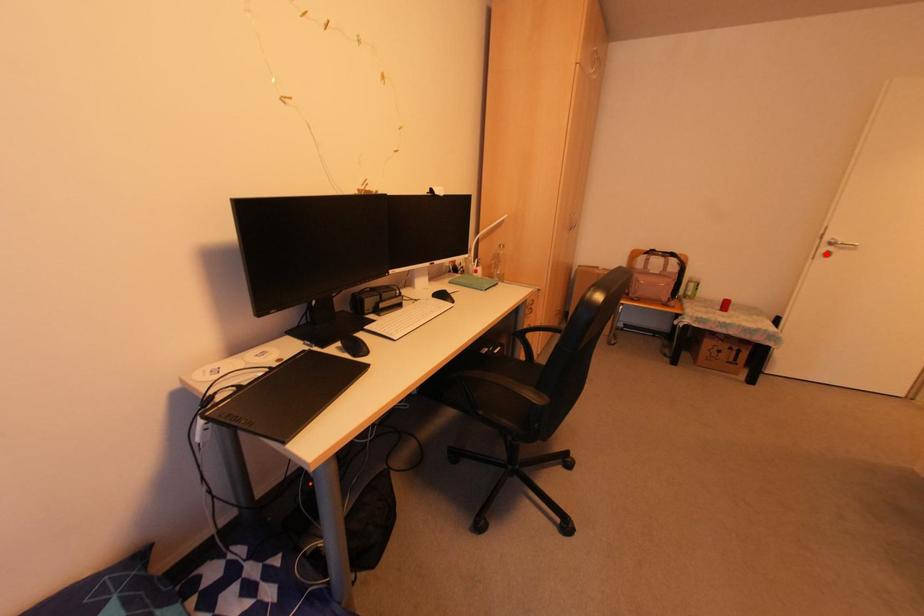
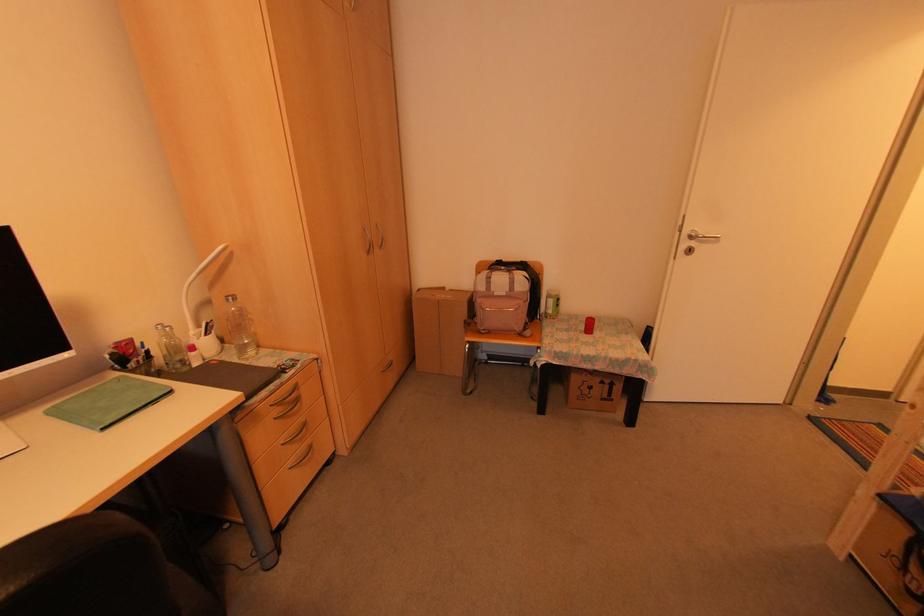
Question: A red point is marked in image1. In image2, is the corresponding 3D point closer to the camera or farther? Reply with the corresponding letter.

Choices:
 (A) The corresponding 3D point is closer.
 (B) The corresponding 3D point is farther.

Answer: (A)